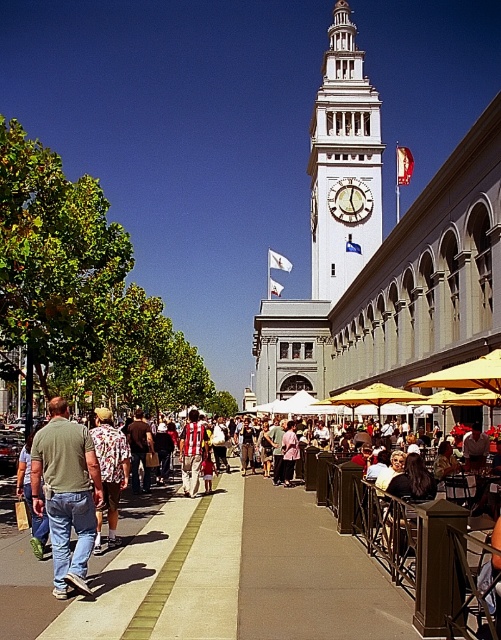
Question: Is white stone clock tower at center in front of striped shirt at center?

Choices:
 (A) no
 (B) yes

Answer: (A)

Question: Which object is positioned closest to the wooden clock at center?

Choices:
 (A) white stone clock tower at center
 (B) floral shirt at left
 (C) striped shirt at center
 (D) matte green shirt at center

Answer: (A)

Question: Which point is farther to the camera?

Choices:
 (A) (368, 211)
 (B) (76, 442)
 (C) (109, 490)
 (D) (343, 176)

Answer: (D)

Question: Which object is positioned closest to the floral shirt at left?

Choices:
 (A) wooden clock at center
 (B) striped shirt at center
 (C) white stone clock tower at center

Answer: (B)

Question: Does white stone clock tower at center have a lesser width compared to floral shirt at left?

Choices:
 (A) no
 (B) yes

Answer: (A)

Question: Does white stone clock tower at center appear on the left side of striped shirt at center?

Choices:
 (A) yes
 (B) no

Answer: (B)